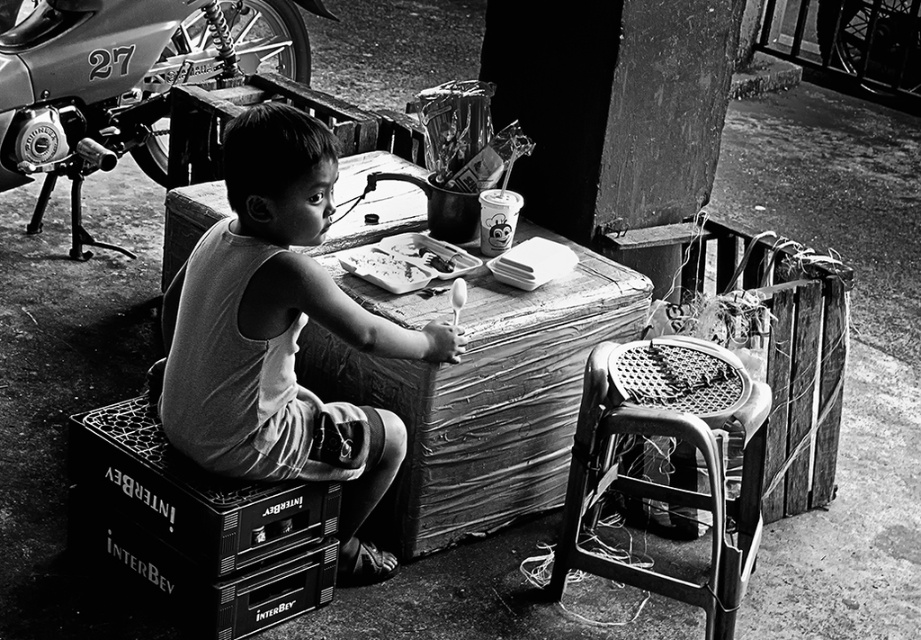
From the picture: You are a photographer analyzing this black and white photo. You notice the smooth cotton shirt at center and the metallic silver motorbike at left. Based on their positions, which object is closer to the bottom edge of the photo?

The smooth cotton shirt at center is located below the metallic silver motorbike at left, so it is closer to the bottom edge of the photo.

You are a photographer standing in front of the scene described. You want to place a small tripod between the black plastic box at lower left and the motorcycle in the background. Is the space between them sufficient to fit the tripod, considering the tripod has a base width of 1 meter?

The distance of black plastic box at lower left from viewer is 2.89 meters, but the exact distance between the black plastic box at lower left and the motorcycle in the background is not provided. Therefore, it is impossible to determine if the space is sufficient for the tripod.

Consider the image. You are a tailor who needs to determine which item is easier to fold neatly. Based on the scene, which object is thinner between the smooth cotton shirt at center and the metallic silver motorbike at left?

The smooth cotton shirt at center is thinner than the metallic silver motorbike at left, so it is easier to fold neatly.